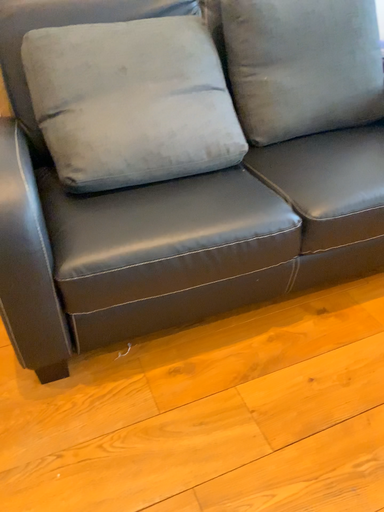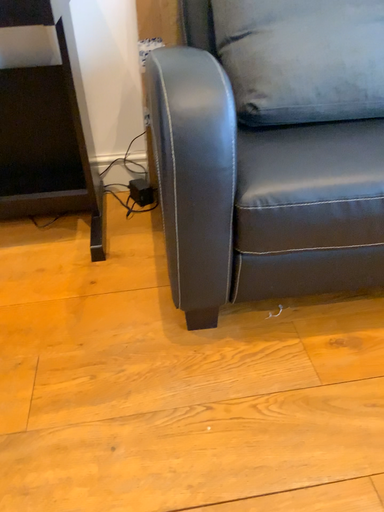
Question: How did the camera likely rotate when shooting the video?

Choices:
 (A) rotated right
 (B) rotated left

Answer: (B)